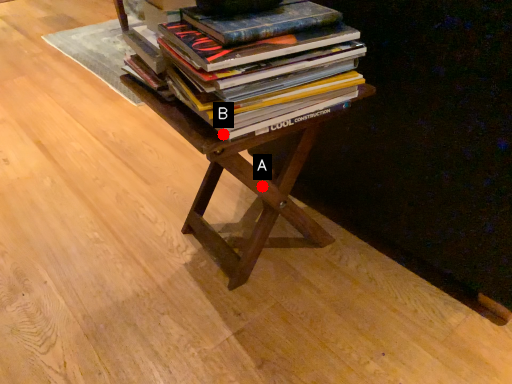
Question: Two points are circled on the image, labeled by A and B beside each circle. Which point appears closest to the camera in this image?

Choices:
 (A) A is closer
 (B) B is closer

Answer: (B)